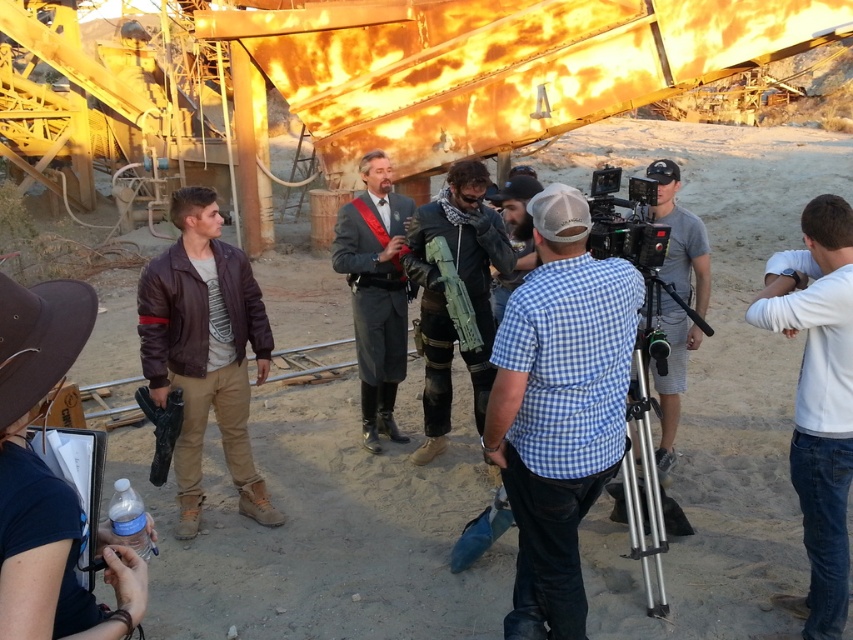
You are a costume designer checking the actors in a desert film set. You need to ensure that the brown leather jacket at lower left and the gray wool suit at center are visible to the camera. Considering their heights, which costume might need adjustment to ensure visibility?

The brown leather jacket at lower left has a lesser height compared to gray wool suit at center, so the actor wearing the brown leather jacket at lower left might need to adjust their position or the costume to ensure better visibility.

You are a camera operator positioned at the filming location. You need to focus on two points in the scene for a closeup shot. The first point is point (0, 529) and the second is point (398, 316). Which point should you focus on first to ensure the closest subject is captured?

Point (0, 529) is closer to the viewer than point (398, 316), so you should focus on point (0, 529) first to capture the closest subject.